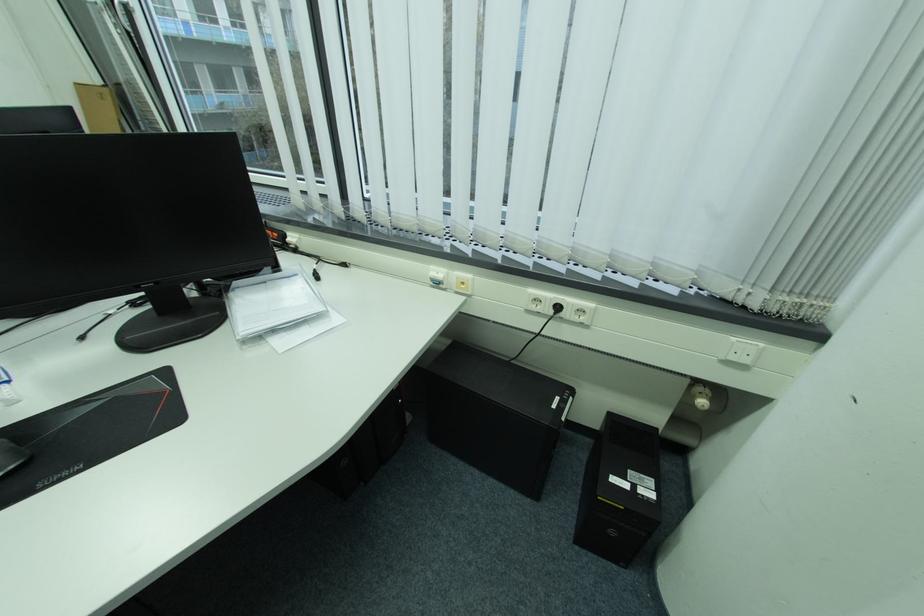
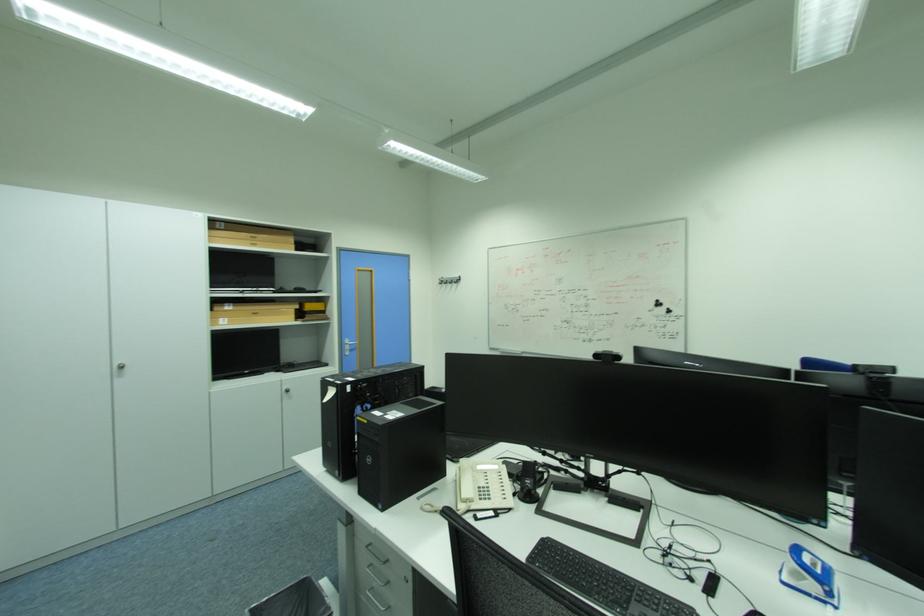
Question: How did the camera likely rotate?

Choices:
 (A) Left
 (B) Right
 (C) Up
 (D) Down

Answer: (A)